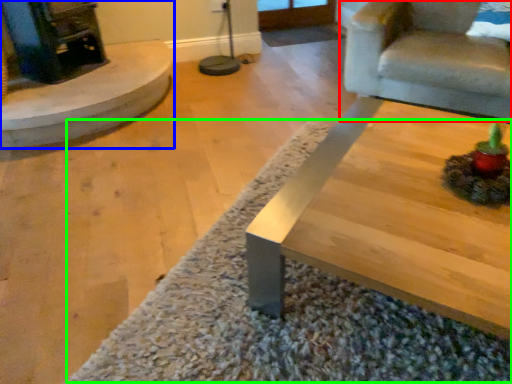
Question: Which is nearer to the chair (highlighted by a red box)? fireplace (highlighted by a blue box) or mat (highlighted by a green box).

Choices:
 (A) fireplace
 (B) mat

Answer: (B)